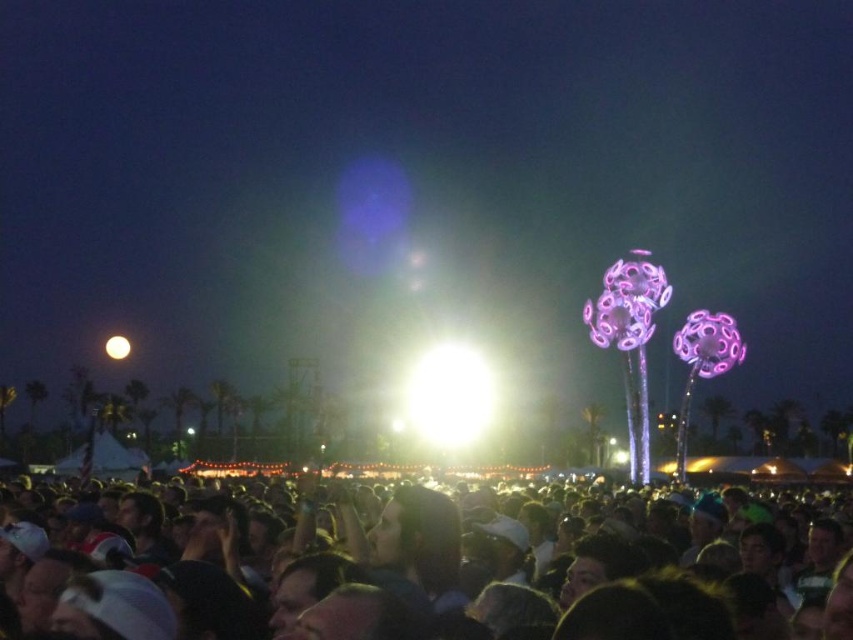
Question: Which point appears closest to the camera in this image?

Choices:
 (A) (117, 339)
 (B) (497, 634)

Answer: (B)

Question: Is dark matte crowd at center smaller than bright white sphere at upper center?

Choices:
 (A) yes
 (B) no

Answer: (B)

Question: Which point is closer to the camera?

Choices:
 (A) dark matte crowd at center
 (B) bright white sphere at upper center

Answer: (A)

Question: Is dark matte crowd at center positioned at the back of bright white sphere at upper center?

Choices:
 (A) yes
 (B) no

Answer: (B)

Question: Does dark matte crowd at center appear under bright white sphere at upper center?

Choices:
 (A) yes
 (B) no

Answer: (A)